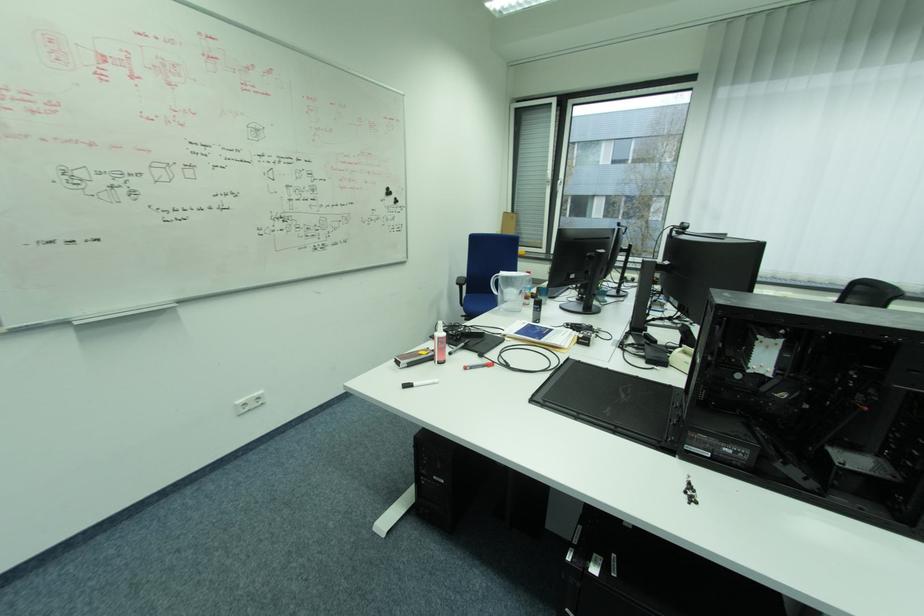
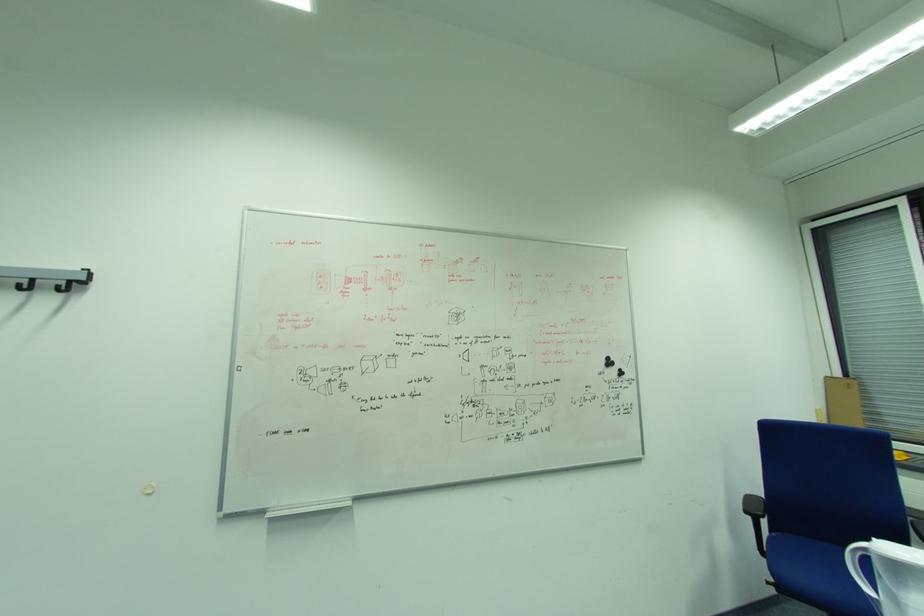
In the second image, find the point that corresponds to the point at 471,315 in the first image.

(782, 582)